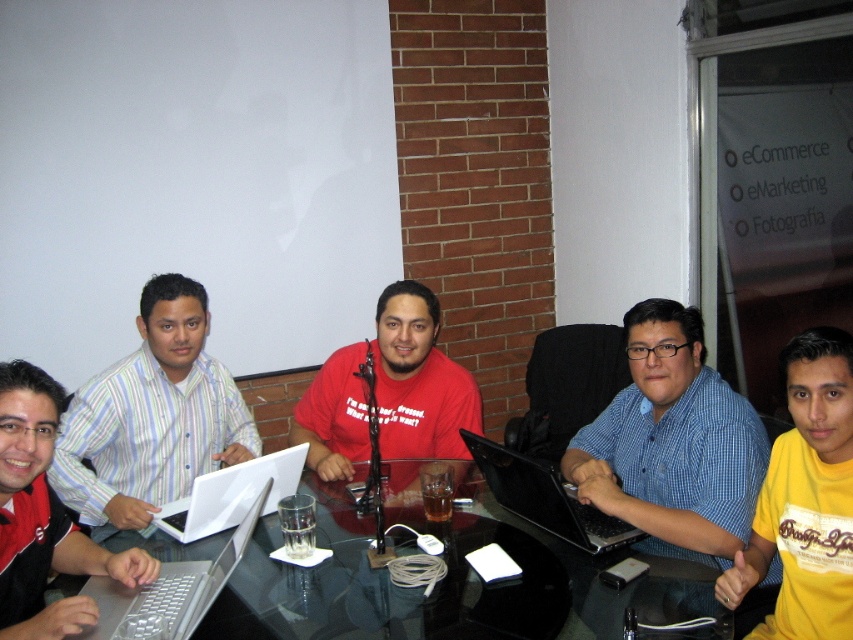
You are sitting at the black glass table at center and want to reach the silver metallic laptop at lower left. Which direction should you move to get it?

The silver metallic laptop at lower left is behind the black glass table at center, so you should move backward to reach it.

You are standing in the office scene described. There is a point marked at coordinates [672,442]. What object or person is located at that point?

The point at coordinates [672,442] marks the blue checkered shirt at center.